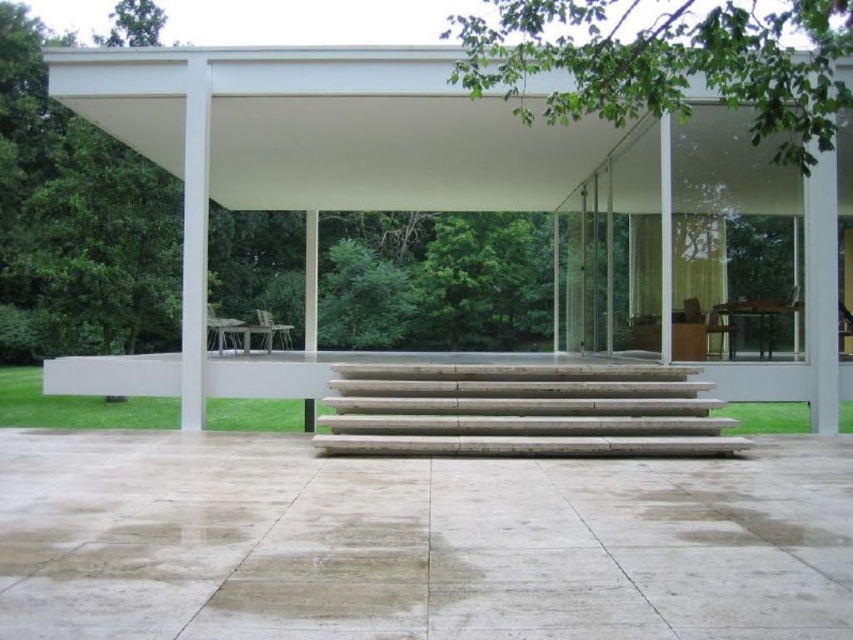
Question: Can you confirm if smooth concrete steps at center is positioned above white matte canopy at upper center?

Choices:
 (A) yes
 (B) no

Answer: (B)

Question: Which point is farther from the camera taking this photo?

Choices:
 (A) (183, 636)
 (B) (495, 428)

Answer: (B)

Question: Is the position of white matte canopy at upper center more distant than that of white marble stairs at center?

Choices:
 (A) no
 (B) yes

Answer: (B)

Question: Among these objects, which one is farthest from the camera?

Choices:
 (A) white marble stairs at center
 (B) smooth concrete steps at center
 (C) white concrete pergola at center
 (D) white matte canopy at upper center

Answer: (D)

Question: Which object is positioned farthest from the white marble stairs at center?

Choices:
 (A) white matte canopy at upper center
 (B) white concrete pergola at center
 (C) smooth concrete steps at center

Answer: (A)

Question: In this image, where is smooth concrete steps at center located relative to white matte canopy at upper center?

Choices:
 (A) right
 (B) left

Answer: (B)